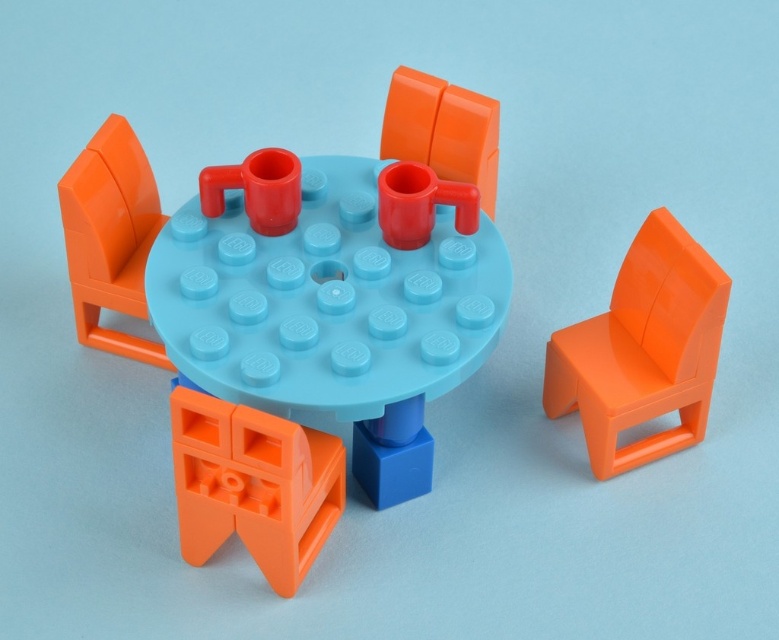
Question: Estimate the real-world distances between objects in this image. Which object is farther from the orange matte chair at center?

Choices:
 (A) orange plastic chair at left
 (B) light blue plastic table at center
 (C) orange matte chair at lower left

Answer: (C)

Question: Which point is farther to the camera?

Choices:
 (A) light blue plastic table at center
 (B) orange plastic chair at left

Answer: (B)

Question: Can you confirm if orange glossy chair at right is thinner than orange plastic chair at left?

Choices:
 (A) no
 (B) yes

Answer: (A)

Question: Can you confirm if light blue plastic table at center is positioned below orange glossy chair at right?

Choices:
 (A) yes
 (B) no

Answer: (B)

Question: Where is light blue plastic table at center located in relation to orange glossy chair at right in the image?

Choices:
 (A) above
 (B) below

Answer: (A)

Question: Based on their relative distances, which object is nearer to the light blue plastic table at center?

Choices:
 (A) orange plastic chair at left
 (B) orange glossy chair at right
 (C) orange matte chair at lower left

Answer: (C)